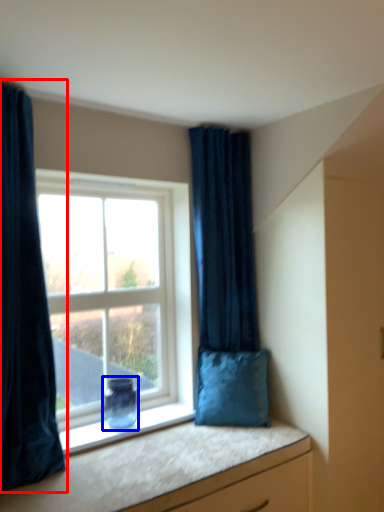
Question: Among these objects, which one is nearest to the camera, curtain (highlighted by a red box) or vase (highlighted by a blue box)?

Choices:
 (A) curtain
 (B) vase

Answer: (A)